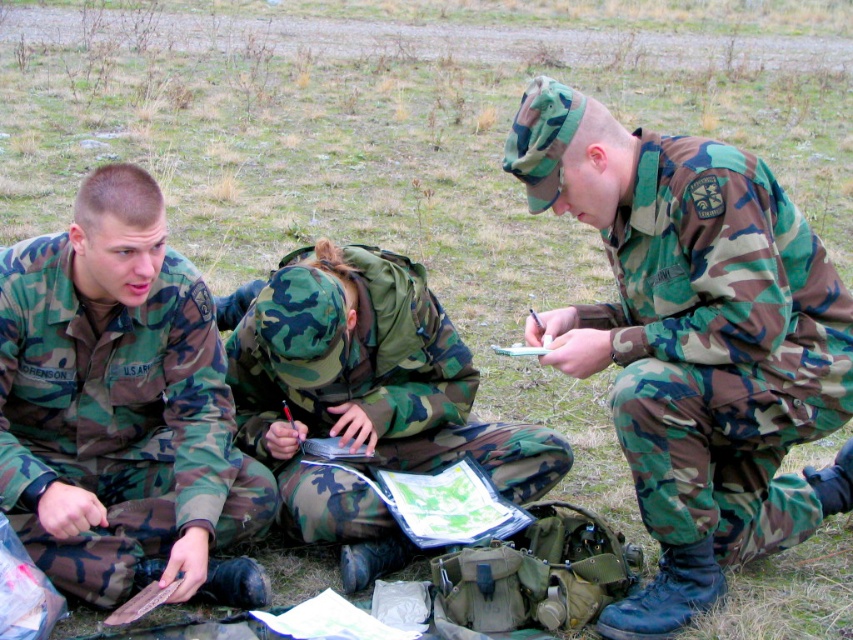
You are a photographer positioned at the camera location. You need to capture a closeup shot of the camouflage fabric uniform at center. Considering the distance, will you need to use a zoom lens to get a clear closeup?

The camouflage fabric uniform at center is 2.46 meters from the camera. A zoom lens would be necessary to achieve a clear closeup from that distance.

You are a new recruit standing at the position of the viewer. You need to hand a map to the camouflage fabric uniform at center. Can you reach them without moving your feet?

The camouflage fabric uniform at center and viewer are 2.46 meters apart. Since the average arm reach is about 1.5 meters, you cannot reach them without moving your feet.

You are a photographer trying to capture a group photo of the camouflage fabric uniform at center and the camo fabric uniform at center. Which one should you position to the left side of the photo to maintain their original arrangement?

You should position the camo fabric uniform at center to the left side of the photo because the camouflage fabric uniform at center is originally to the right of camo fabric uniform at center.